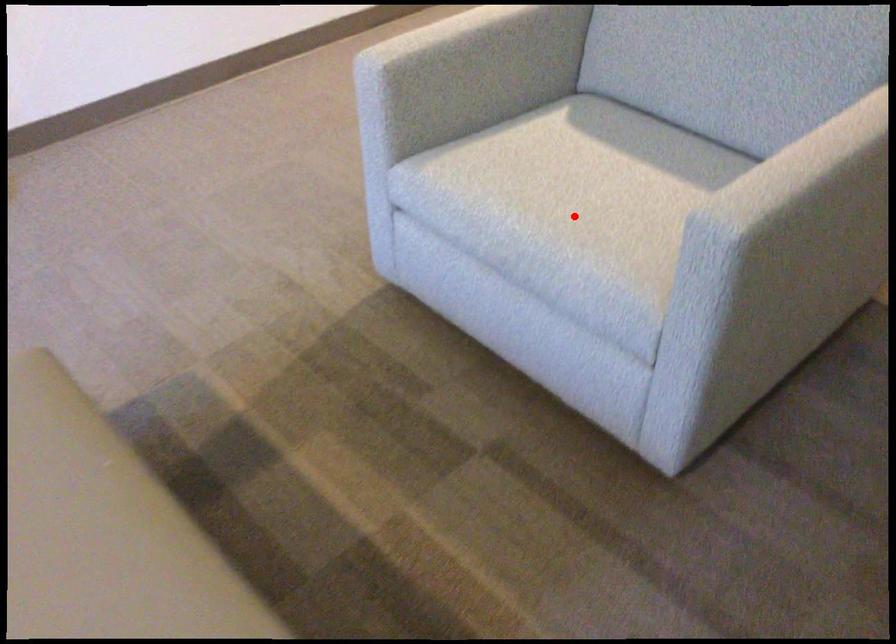
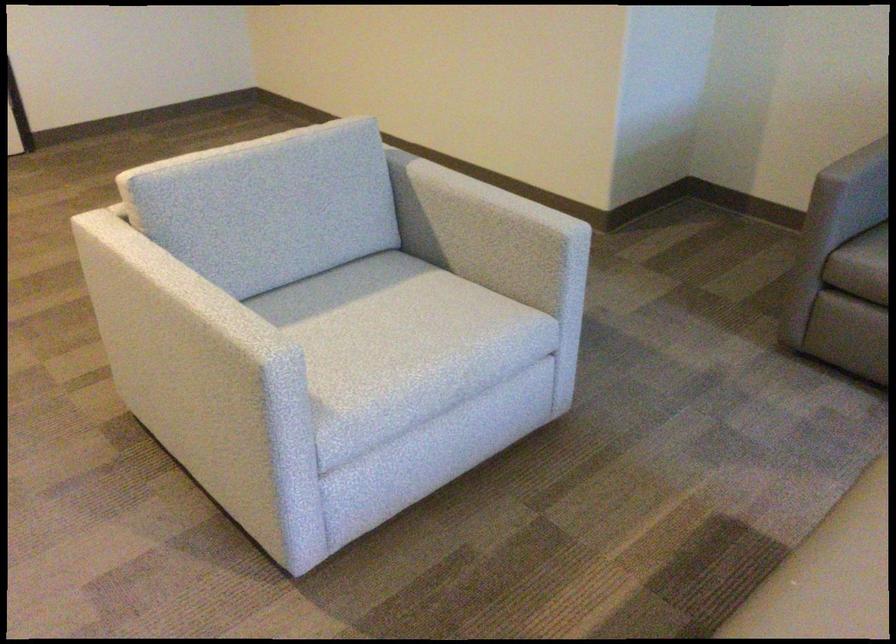
The point at the highlighted location is marked in the first image. Where is the corresponding point in the second image?

(427, 333)